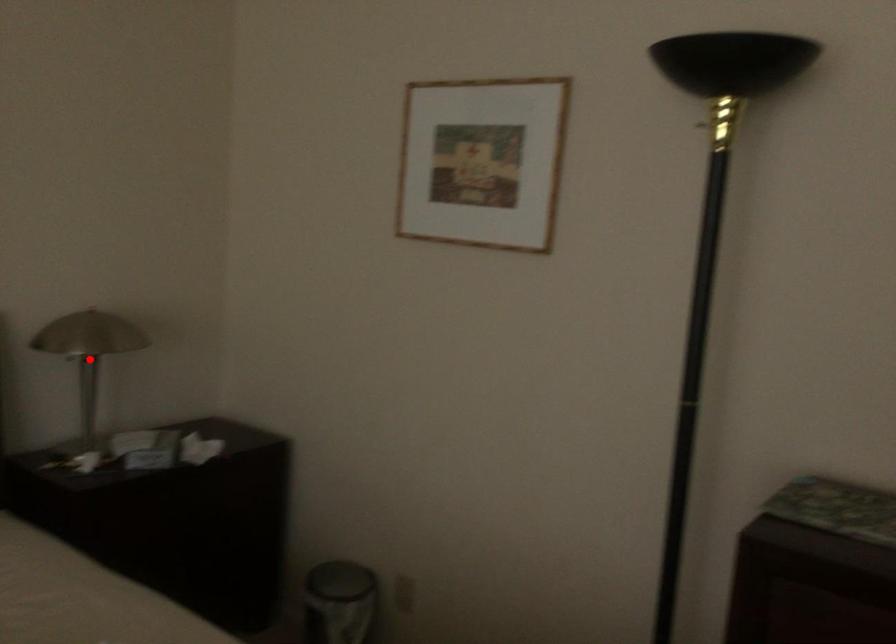
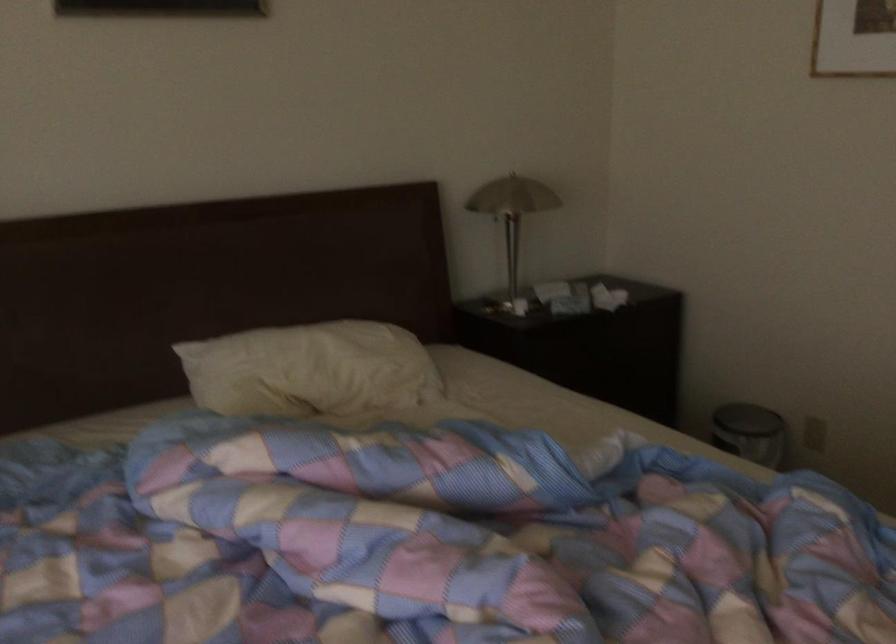
Question: I am providing you with two images of the same scene from different viewpoints. Given a red point in image1, look at the same physical point in image2. Is it:

Choices:
 (A) Closer to the viewpoint
 (B) Farther from the viewpoint

Answer: (B)